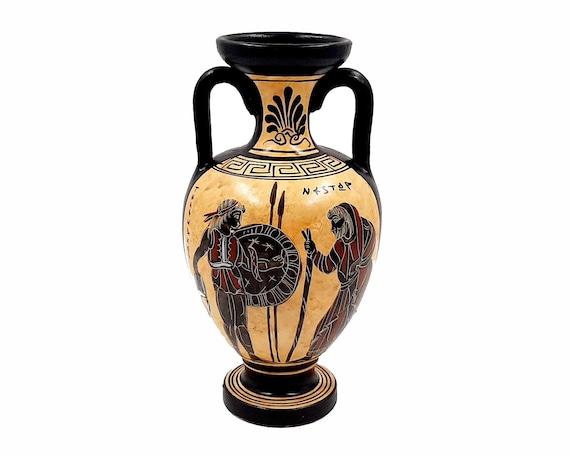
Where is `neck of vase`? neck of vase is located at coordinates (279, 133).